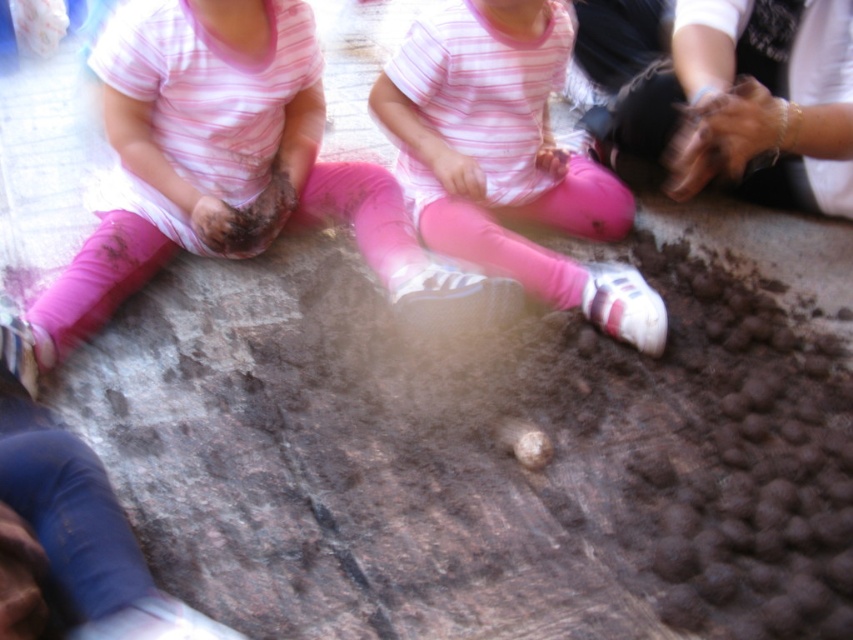
This screenshot has height=640, width=853. Describe the element at coordinates (213, 164) in the screenshot. I see `pink matte leggings at lower left` at that location.

The width and height of the screenshot is (853, 640). Describe the element at coordinates (213, 164) in the screenshot. I see `pink matte leggings at lower left` at that location.

At what (x,y) coordinates should I click in order to perform the action: click on pink matte leggings at lower left. Please return your answer as a coordinate pair (x, y). The height and width of the screenshot is (640, 853). Looking at the image, I should click on (213, 164).